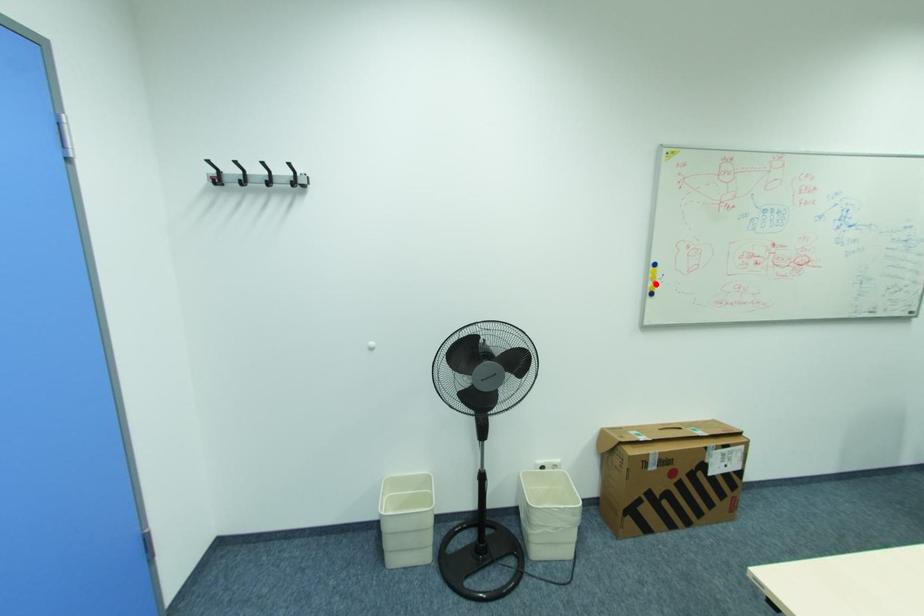
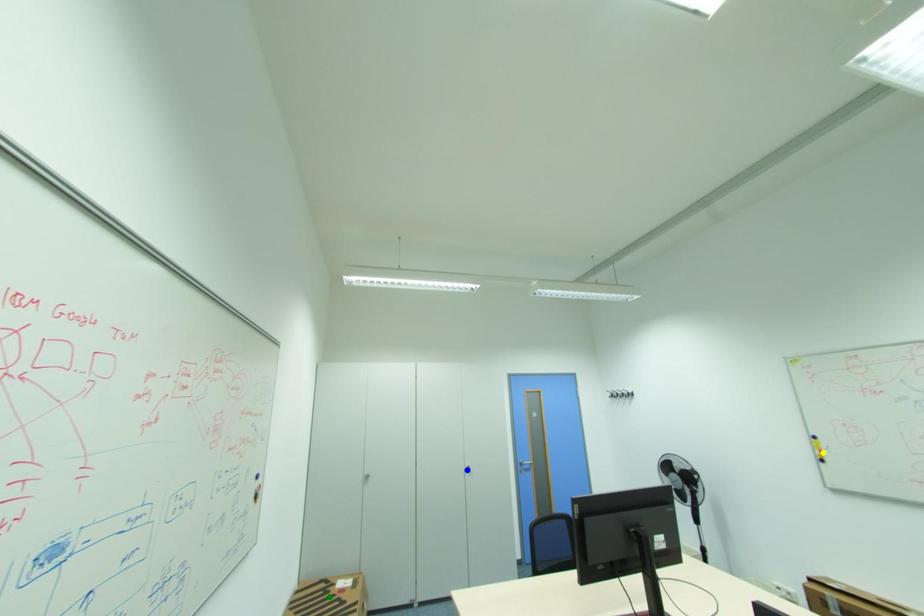
Question: I am providing you with two images of the same scene from different viewpoints. A red point is marked on the first image. You are given multiple points on the second image. Which point in image 2 represents the same 3d spot as the red point in image 1?

Choices:
 (A) blue point
 (B) yellow point
 (C) green point

Answer: (B)